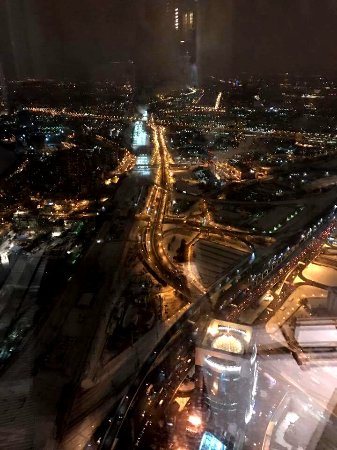
This screenshot has height=450, width=337. Identify the location of reflection in window. (290, 399), (261, 338), (326, 333).